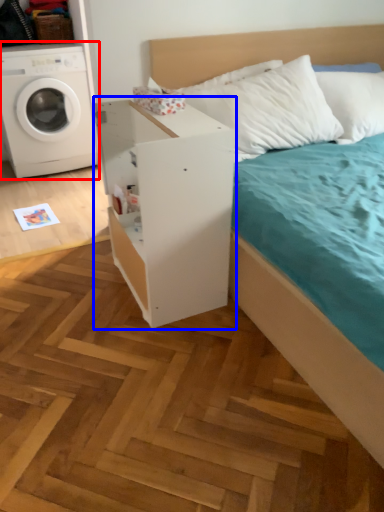
Question: Among these objects, which one is farthest to the camera, washing machine (highlighted by a red box) or dresser (highlighted by a blue box)?

Choices:
 (A) washing machine
 (B) dresser

Answer: (A)